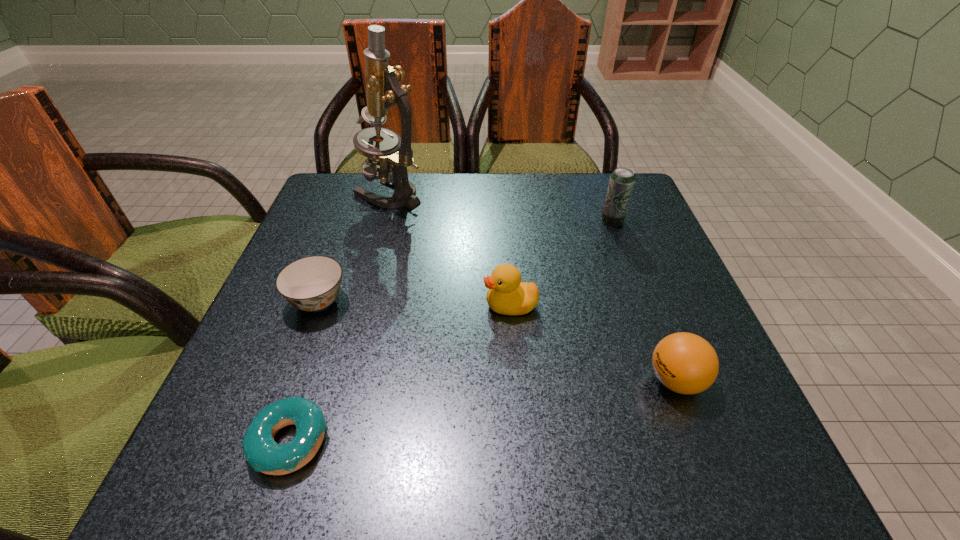
Where is `free spot located on the back of the fifth shortest object`? free spot located on the back of the fifth shortest object is located at coordinates tap(598, 181).

Image resolution: width=960 pixels, height=540 pixels. Find the location of `blank space located at the beak of the fourth object from left to right`. blank space located at the beak of the fourth object from left to right is located at coordinates (328, 306).

The height and width of the screenshot is (540, 960). Find the location of `blank space located 0.230m at the beak of the fourth object from left to right`. blank space located 0.230m at the beak of the fourth object from left to right is located at coordinates (361, 306).

Where is `free point located at the beak of the fourth object from left to right`? free point located at the beak of the fourth object from left to right is located at coordinates (276, 306).

At what (x,y) coordinates should I click in order to perform the action: click on vacant area situated on the side with brand of the ping-pong ball. Please return your answer as a coordinate pair (x, y). The height and width of the screenshot is (540, 960). Looking at the image, I should click on (615, 381).

Image resolution: width=960 pixels, height=540 pixels. What are the coordinates of `vacant space located on the side with brand of the ping-pong ball` in the screenshot? It's located at (516, 381).

The width and height of the screenshot is (960, 540). I want to click on free space located 0.140m on the side with brand of the ping-pong ball, so click(560, 381).

This screenshot has height=540, width=960. In order to click on blank space located on the back of the soup bowl in this screenshot , I will do `click(355, 200)`.

The height and width of the screenshot is (540, 960). Identify the location of vacant area situated on the right of the shortest object. click(x=531, y=442).

This screenshot has width=960, height=540. Identify the location of microscope that is at the far edge. (394, 154).